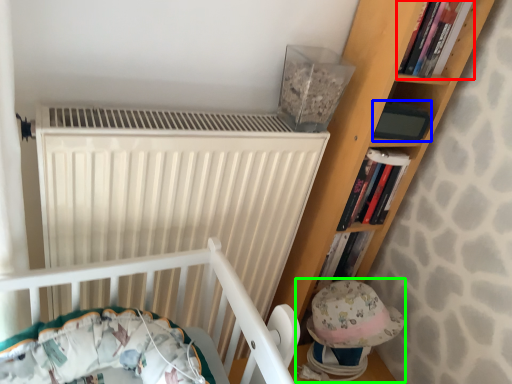
Question: Which is farther away from book (highlighted by a red box)? paperback book (highlighted by a blue box) or toy (highlighted by a green box)?

Choices:
 (A) paperback book
 (B) toy

Answer: (B)